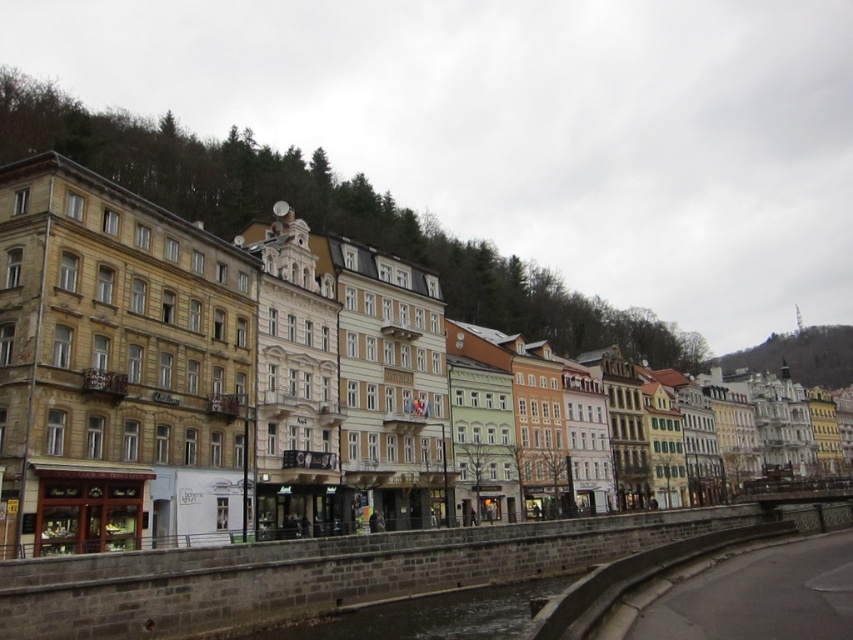
Question: Which point is farther to the camera?

Choices:
 (A) (187, 522)
 (B) (372, 612)

Answer: (A)

Question: Which of the following is the closest to the observer?

Choices:
 (A) (3, 432)
 (B) (579, 576)

Answer: (A)

Question: Does beige stone buildings at center lie in front of brown stone waterway at lower center?

Choices:
 (A) no
 (B) yes

Answer: (A)

Question: Does beige stone buildings at center come behind brown stone waterway at lower center?

Choices:
 (A) no
 (B) yes

Answer: (B)

Question: Where is beige stone buildings at center located in relation to brown stone waterway at lower center in the image?

Choices:
 (A) above
 (B) below

Answer: (A)